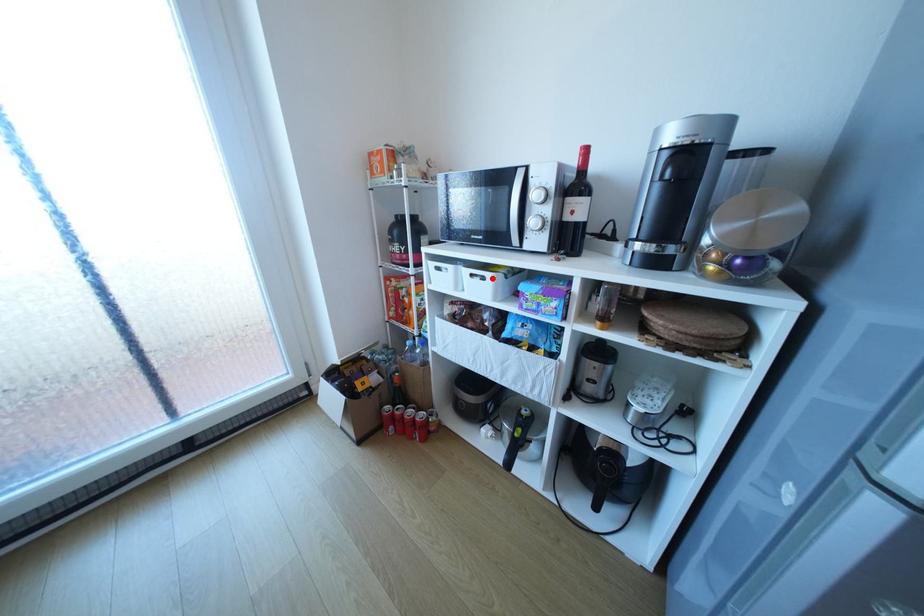
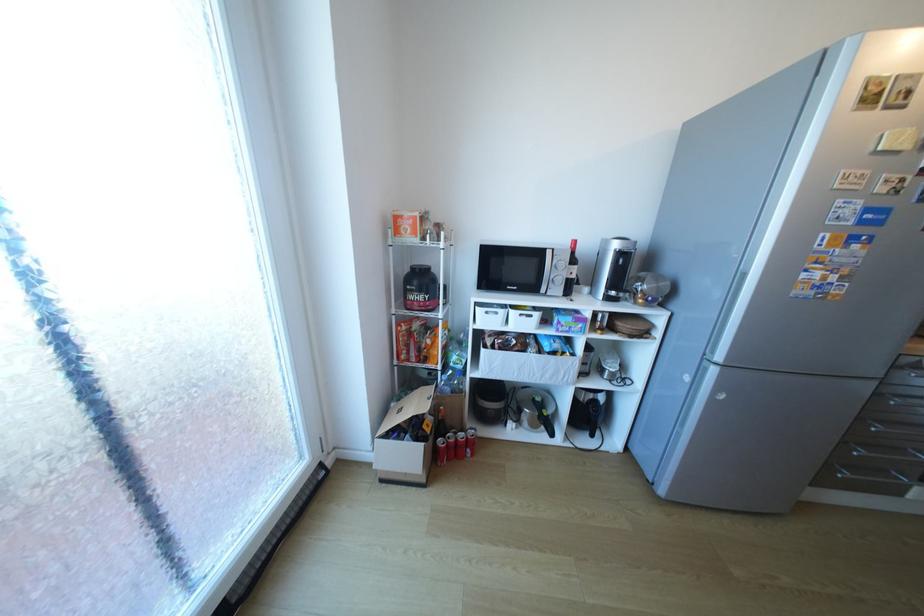
The point at the highlighted location is marked in the first image. Where is the corresponding point in the second image?

(540, 315)